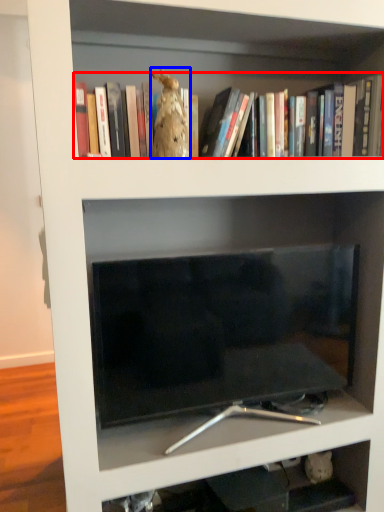
Question: Which object is further to the camera taking this photo, book (highlighted by a red box) or animal (highlighted by a blue box)?

Choices:
 (A) book
 (B) animal

Answer: (B)